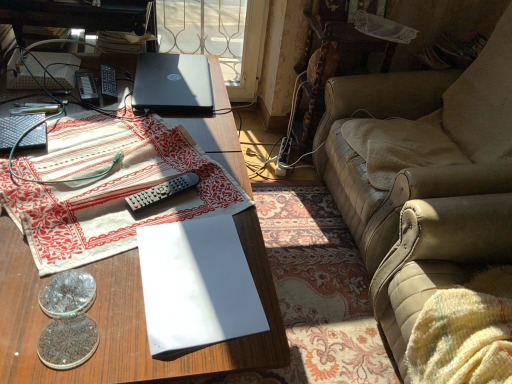
Where is `free space behind black plastic remote control at upper left, which is the first remote control from left to right`? The image size is (512, 384). free space behind black plastic remote control at upper left, which is the first remote control from left to right is located at coordinates (109, 71).